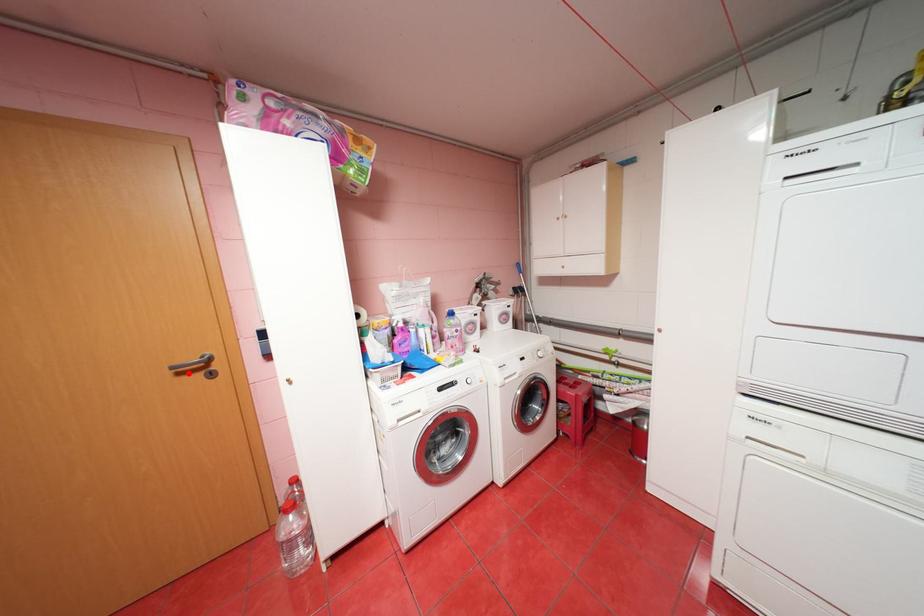
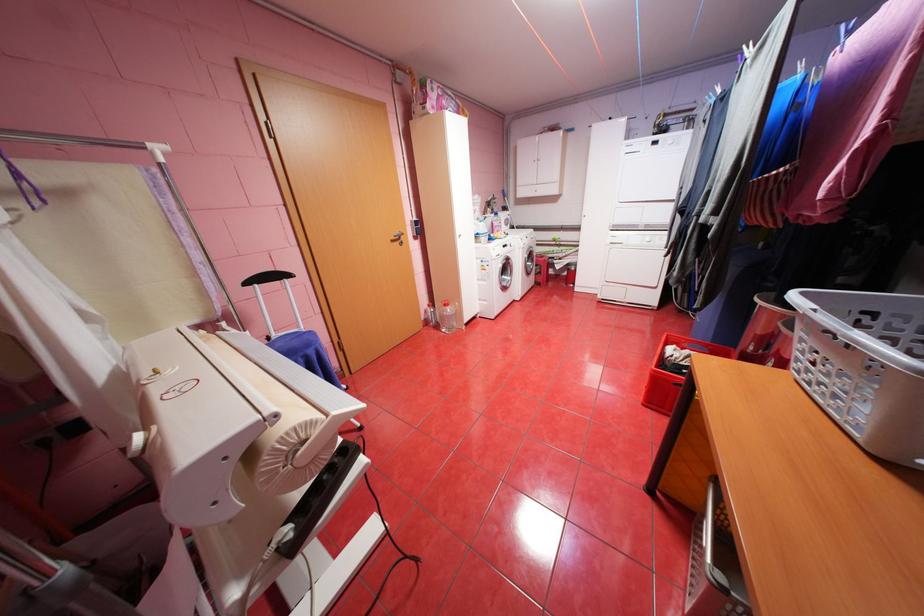
The point at the highlighted location is marked in the first image. Where is the corresponding point in the second image?

(400, 241)